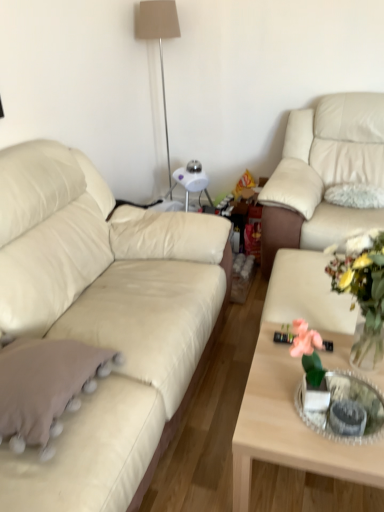
At what (x,y) coordinates should I click in order to perform the action: click on vacant region to the left of translucent glass vase at center. Please return your answer as a coordinate pair (x, y). The height and width of the screenshot is (512, 384). Looking at the image, I should click on (274, 373).